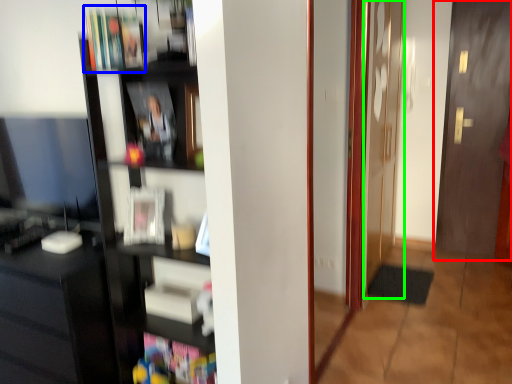
Question: Based on their relative distances, which object is nearer to door (highlighted by a red box)? Choose from book (highlighted by a blue box) and screen door (highlighted by a green box).

Choices:
 (A) book
 (B) screen door

Answer: (B)